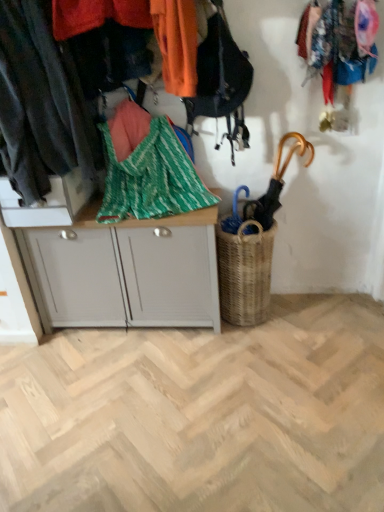
What is the approximate height of orange fabric at upper center, which appears as the second clothing when viewed from the left?

orange fabric at upper center, which appears as the second clothing when viewed from the left, is 14.20 inches tall.

What are the coordinates of `white matte cabinet at center` in the screenshot? It's located at (124, 271).

What do you see at coordinates (276, 182) in the screenshot? This screenshot has width=384, height=512. I see `wooden umbrella at right` at bounding box center [276, 182].

What do you see at coordinates (147, 169) in the screenshot? I see `green woven blanket at center` at bounding box center [147, 169].

Where is `orange fabric at upper center, which ranks as the first clothing in right-to-left order`? This screenshot has width=384, height=512. orange fabric at upper center, which ranks as the first clothing in right-to-left order is located at coordinates (176, 44).

From the image's perspective, is woven brown basket at center-right located above or below green woven blanket at center?

Clearly, from the image's perspective, woven brown basket at center-right is below green woven blanket at center.

Which object is positioned more to the right, woven brown basket at center-right or green woven blanket at center?

Positioned to the right is woven brown basket at center-right.

Is point (263, 301) in front of point (105, 132)?

No, it is behind (105, 132).

There is a white matte cabinet at center. Where is `the 2nd clothing above it (from the image's perspective)`? The height and width of the screenshot is (512, 384). the 2nd clothing above it (from the image's perspective) is located at coordinates (176, 44).

Could you measure the distance between orange fabric at upper center, which ranks as the first clothing in right-to-left order, and white matte cabinet at center?

orange fabric at upper center, which ranks as the first clothing in right-to-left order, is 29.81 inches away from white matte cabinet at center.

From a real-world perspective, which is physically below, orange fabric at upper center, which appears as the second clothing when viewed from the left, or white matte cabinet at center?

white matte cabinet at center.

From the image's perspective, which one is positioned higher, orange fabric at upper center, which appears as the second clothing when viewed from the left, or white matte cabinet at center?

orange fabric at upper center, which appears as the second clothing when viewed from the left.

From the picture: Choose the correct answer: Is woven brown basket at center-right inside orange fabric at upper center, which appears as the second clothing when viewed from the left, or outside it?

woven brown basket at center-right lies outside orange fabric at upper center, which appears as the second clothing when viewed from the left.

From a real-world perspective, between woven brown basket at center-right and orange fabric at upper center, which appears as the second clothing when viewed from the left, who is vertically lower?

woven brown basket at center-right.

Which is more distant, (267, 297) or (190, 86)?

The point (267, 297) is behind.

Is woven brown basket at center-right facing away from orange fabric at upper center, which appears as the second clothing when viewed from the left?

That's not correct — woven brown basket at center-right is not looking away from orange fabric at upper center, which appears as the second clothing when viewed from the left.

In terms of width, does orange fabric at upper center, which ranks as the first clothing in right-to-left order, look wider or thinner when compared to green woven blanket at center?

Clearly, orange fabric at upper center, which ranks as the first clothing in right-to-left order, has less width compared to green woven blanket at center.

Does orange fabric at upper center, which appears as the second clothing when viewed from the left, have a smaller size compared to green woven blanket at center?

Correct, orange fabric at upper center, which appears as the second clothing when viewed from the left, occupies less space than green woven blanket at center.

From a real-world perspective, is orange fabric at upper center, which appears as the second clothing when viewed from the left, located higher than green woven blanket at center?

Yes, from a real-world perspective, orange fabric at upper center, which appears as the second clothing when viewed from the left, is above green woven blanket at center.

Is orange fabric at upper center, which ranks as the first clothing in right-to-left order, facing towards woven brown basket at center-right?

No, orange fabric at upper center, which ranks as the first clothing in right-to-left order, does not turn towards woven brown basket at center-right.

This screenshot has height=512, width=384. Identify the location of the 1st clothing to the left of the woven brown basket at center-right, counting from the anchor's position. (176, 44).

Is orange fabric at upper center, which appears as the second clothing when viewed from the left, to the left or to the right of woven brown basket at center-right in the image?

orange fabric at upper center, which appears as the second clothing when viewed from the left, is positioned on woven brown basket at center-right's left side.

Based on the photo, is white matte cabinet at center oriented towards green woven blanket at center?

No, white matte cabinet at center is not facing towards green woven blanket at center.

Can you confirm if white matte cabinet at center is smaller than green woven blanket at center?

Incorrect, white matte cabinet at center is not smaller in size than green woven blanket at center.

From a real-world perspective, is white matte cabinet at center positioned above or below green woven blanket at center?

From a real-world perspective, white matte cabinet at center is physically below green woven blanket at center.

Would you say white matte cabinet at center is a long distance from green woven blanket at center?

No.

Between point (162, 301) and point (258, 221), which one is positioned in front?

The point (162, 301) is closer.

Is white matte cabinet at center far from wooden umbrella at right?

Actually, white matte cabinet at center and wooden umbrella at right are a little close together.

Considering the sizes of objects white matte cabinet at center and wooden umbrella at right in the image provided, who is taller, white matte cabinet at center or wooden umbrella at right?

With more height is white matte cabinet at center.

Where is `basket behind the green woven blanket at center`? The image size is (384, 512). basket behind the green woven blanket at center is located at coordinates (245, 273).

The image size is (384, 512). In order to click on the 2nd clothing positioned above the white matte cabinet at center (from the image's perspective) in this screenshot , I will do `click(176, 44)`.

Based on their spatial positions, is green woven blanket at center or white matte cabinet at center further from orange fabric at upper center, which appears as the second clothing when viewed from the left?

white matte cabinet at center lies further to orange fabric at upper center, which appears as the second clothing when viewed from the left, than the other object.

Considering their positions, is orange fabric at upper center, which ranks as the first clothing in right-to-left order, positioned further to white matte cabinet at center than green woven blanket at center?

orange fabric at upper center, which ranks as the first clothing in right-to-left order, lies further to white matte cabinet at center than the other object.

Based on their spatial positions, is woven brown basket at center-right or white matte cabinet at center closer to dark gray fabric at left, the second clothing in the right-to-left sequence?

The object closer to dark gray fabric at left, the second clothing in the right-to-left sequence, is white matte cabinet at center.

Estimate the real-world distances between objects in this image. Which object is further from dark gray fabric at left, the second clothing in the right-to-left sequence, green woven blanket at center or orange fabric at upper center, which ranks as the first clothing in right-to-left order?

Based on the image, orange fabric at upper center, which ranks as the first clothing in right-to-left order, appears to be further to dark gray fabric at left, the second clothing in the right-to-left sequence.

Looking at the image, which one is located further to orange fabric at upper center, which ranks as the first clothing in right-to-left order, woven brown basket at center-right or white matte cabinet at center?

woven brown basket at center-right is further to orange fabric at upper center, which ranks as the first clothing in right-to-left order.

Estimate the real-world distances between objects in this image. Which object is closer to orange fabric at upper center, which ranks as the first clothing in right-to-left order, white matte cabinet at center or green woven blanket at center?

The object closer to orange fabric at upper center, which ranks as the first clothing in right-to-left order, is green woven blanket at center.

When comparing their distances from orange fabric at upper center, which ranks as the first clothing in right-to-left order, does dark gray fabric at left, the second clothing in the right-to-left sequence, or wooden umbrella at right seem closer?

Based on the image, dark gray fabric at left, the second clothing in the right-to-left sequence, appears to be nearer to orange fabric at upper center, which ranks as the first clothing in right-to-left order.

Looking at the image, which one is located further to dark gray fabric at left, which is the first clothing from left to right, white matte cabinet at center or wooden umbrella at right?

Based on the image, wooden umbrella at right appears to be further to dark gray fabric at left, which is the first clothing from left to right.

Where is `blanket between orange fabric at upper center, which appears as the second clothing when viewed from the left, and woven brown basket at center-right from top to bottom`? Image resolution: width=384 pixels, height=512 pixels. blanket between orange fabric at upper center, which appears as the second clothing when viewed from the left, and woven brown basket at center-right from top to bottom is located at coordinates (147, 169).

Where is `blanket between white matte cabinet at center and woven brown basket at center-right from left to right`? The width and height of the screenshot is (384, 512). blanket between white matte cabinet at center and woven brown basket at center-right from left to right is located at coordinates pos(147,169).

The width and height of the screenshot is (384, 512). In order to click on blanket located between dark gray fabric at left, the second clothing in the right-to-left sequence, and woven brown basket at center-right in the left-right direction in this screenshot , I will do `click(147, 169)`.

The image size is (384, 512). I want to click on desk located between dark gray fabric at left, the second clothing in the right-to-left sequence, and woven brown basket at center-right in the left-right direction, so click(124, 271).